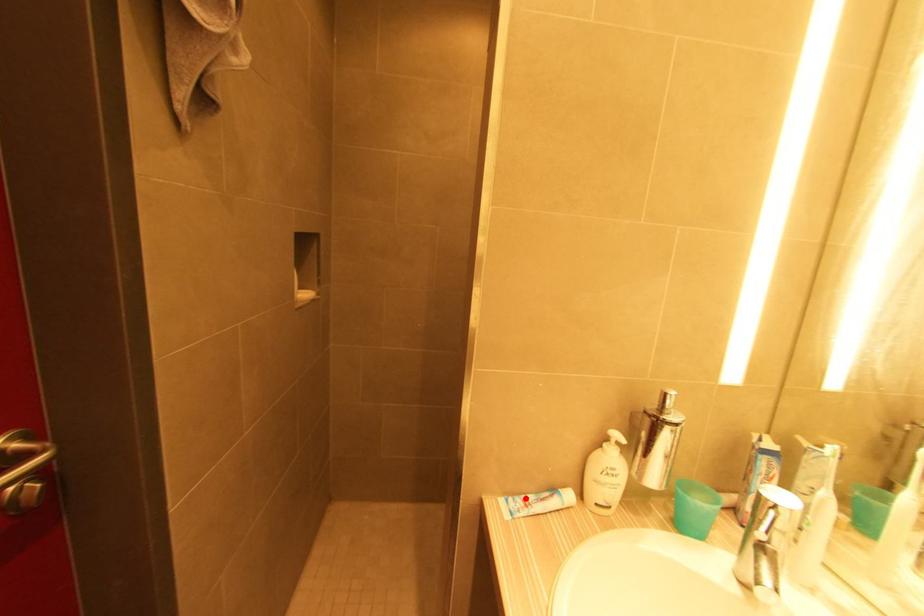
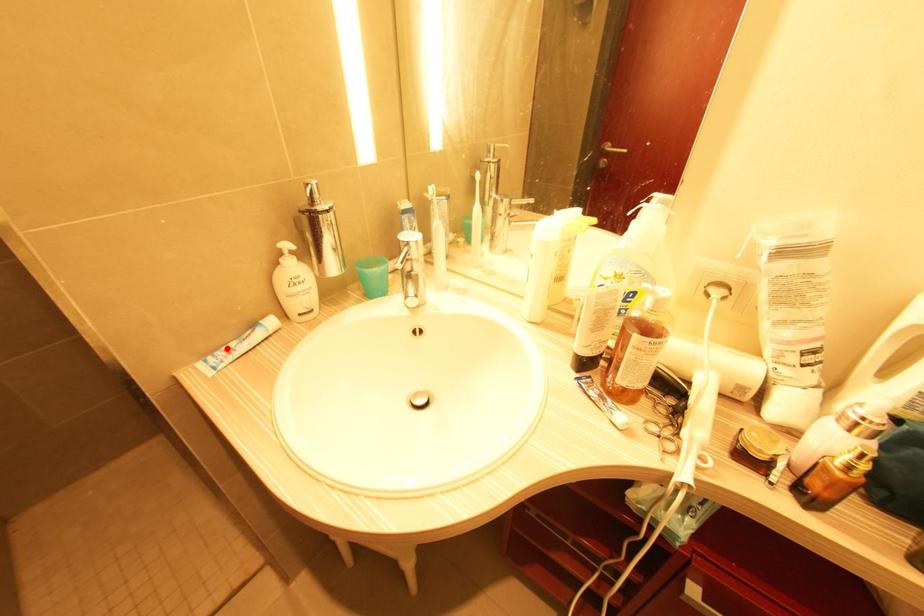
Consider the image. I am providing you with two images of the same scene from different viewpoints. A red point is marked on the first image and another point is marked on the second image. Are the points marked in image1 and image2 representing the same 3D position?

Yes